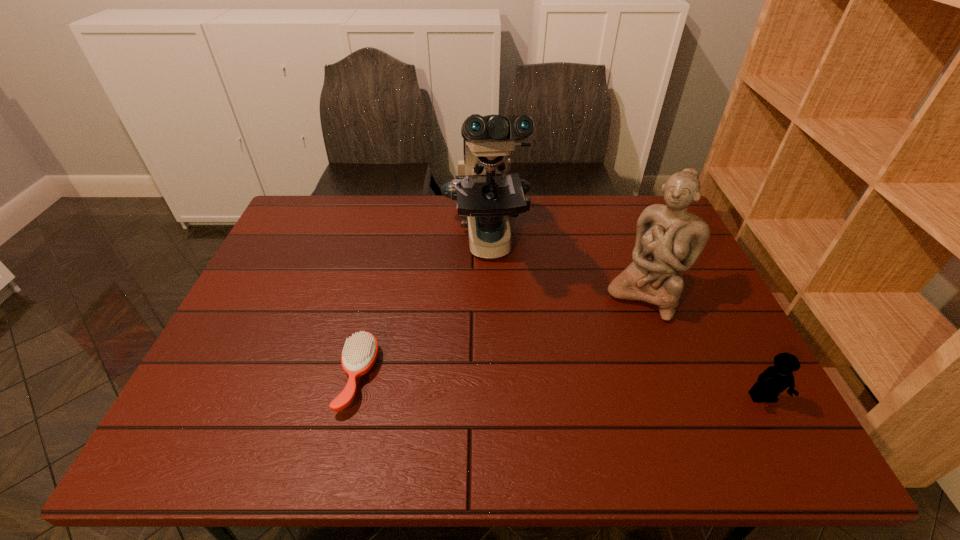
Find the location of a particular element. The width and height of the screenshot is (960, 540). object located in the near right corner section of the desktop is located at coordinates (775, 379).

At what (x,y) coordinates should I click in order to perform the action: click on vacant space at the far edge. Please return your answer as a coordinate pair (x, y). The width and height of the screenshot is (960, 540). Looking at the image, I should click on (574, 202).

Where is `free region at the near edge of the desktop`? free region at the near edge of the desktop is located at coordinates (680, 390).

Locate an element on the screen. blank area at the left edge is located at coordinates (227, 336).

Locate an element on the screen. free space at the right edge of the desktop is located at coordinates (700, 278).

Locate an element on the screen. This screenshot has width=960, height=540. vacant space at the far right corner is located at coordinates coord(649,200).

You are a GUI agent. You are given a task and a screenshot of the screen. Output one action in this format:
    pyautogui.click(x=<x>, y=<y>)
    Task: Click on the vacant region at the near right corner of the desktop
    
    Given the screenshot: What is the action you would take?
    pyautogui.click(x=747, y=395)

Locate an element on the screen. This screenshot has height=540, width=960. vacant space that's between the second object from left to right and the shortest object is located at coordinates (422, 309).

The height and width of the screenshot is (540, 960). In order to click on free space that is in between the microscope and the hairbrush in this screenshot , I will do `click(422, 309)`.

Identify the location of vacant area that lies between the second object from right to left and the tallest object. This screenshot has height=540, width=960. (565, 268).